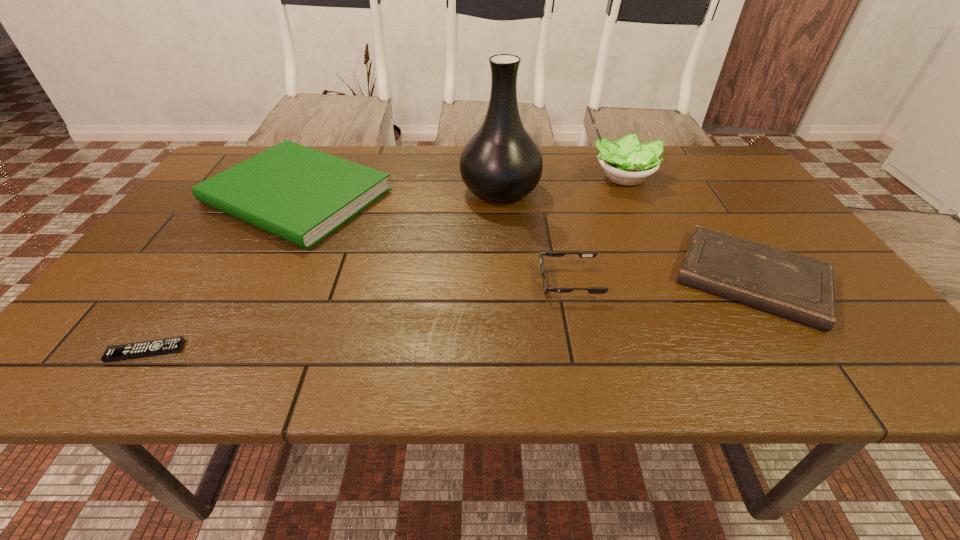
This screenshot has width=960, height=540. Identify the location of free space located 0.120m on the front of the lettuce. (643, 221).

You are a GUI agent. You are given a task and a screenshot of the screen. Output one action in this format:
    pyautogui.click(x=<x>, y=<y>)
    Task: Click on the vacant region located 0.310m on the right of the third tallest object
    The width and height of the screenshot is (960, 540).
    Given the screenshot: What is the action you would take?
    pyautogui.click(x=501, y=195)

I want to click on blank space located 0.080m on the temples of the third shortest object, so click(x=504, y=282).

This screenshot has height=540, width=960. What are the coordinates of `blank area located on the temples of the third shortest object` in the screenshot? It's located at (396, 282).

In order to click on free spot located 0.090m on the temples of the third shortest object in this screenshot , I will do `click(500, 282)`.

This screenshot has height=540, width=960. I want to click on free space located on the left of the second shortest object, so click(620, 278).

The image size is (960, 540). Identify the location of vacant area situated on the right of the nearest object. (224, 351).

The image size is (960, 540). I want to click on vase at the far edge, so click(501, 162).

What are the coordinates of `lettuce positioned at the far edge` in the screenshot? It's located at (627, 162).

The image size is (960, 540). I want to click on paperback book at the far edge, so 299,194.